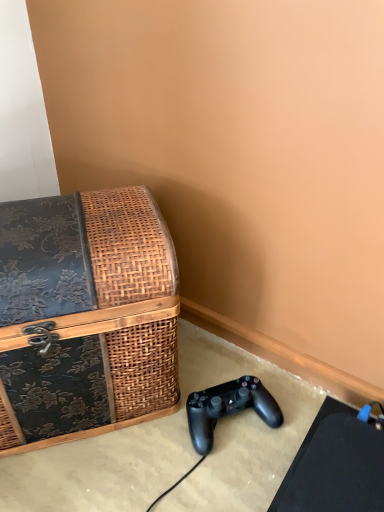
Where is `vacant area located to the right-hand side of woven wood trunk at left`? vacant area located to the right-hand side of woven wood trunk at left is located at coordinates (219, 385).